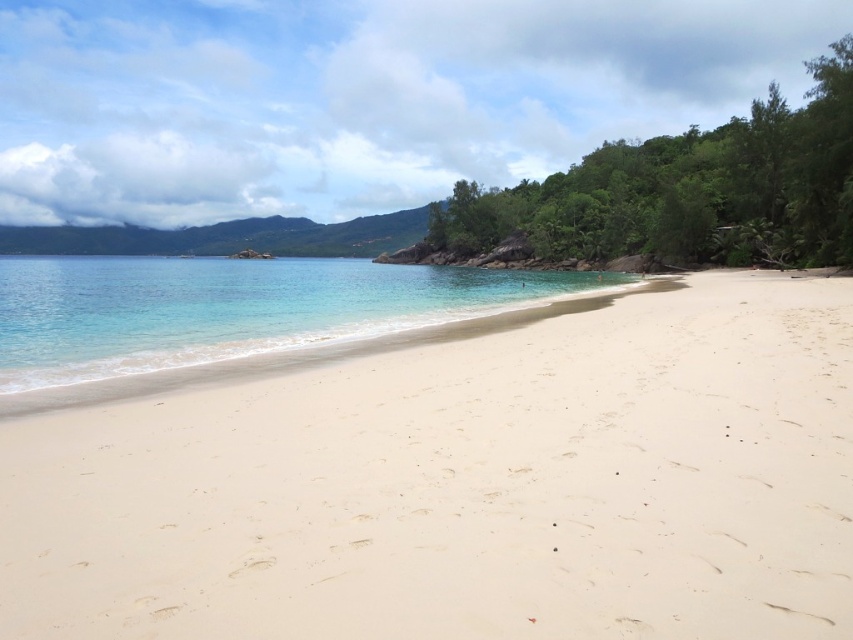
Question: Does white sand at center appear on the right side of clear water at center?

Choices:
 (A) no
 (B) yes

Answer: (B)

Question: Which point is farther from the camera taking this photo?

Choices:
 (A) [215, 272]
 (B) [746, 451]

Answer: (A)

Question: Considering the relative positions of white sand at center and clear water at center in the image provided, where is white sand at center located with respect to clear water at center?

Choices:
 (A) below
 (B) above

Answer: (A)

Question: Can you confirm if white sand at center is smaller than clear water at center?

Choices:
 (A) no
 (B) yes

Answer: (B)

Question: Among these objects, which one is farthest from the camera?

Choices:
 (A) clear water at center
 (B) white sand at center

Answer: (A)